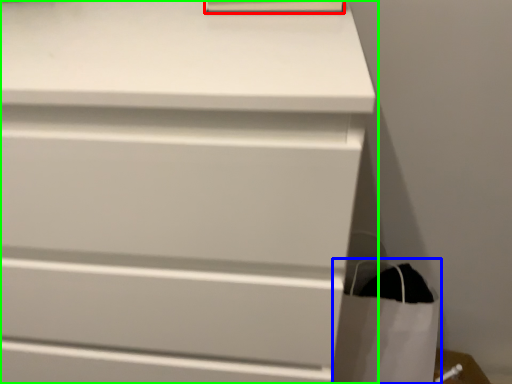
Question: Estimate the real-world distances between objects in this image. Which object is farther from paperback book (highlighted by a red box), shopping bag (highlighted by a blue box) or chest of drawers (highlighted by a green box)?

Choices:
 (A) shopping bag
 (B) chest of drawers

Answer: (A)